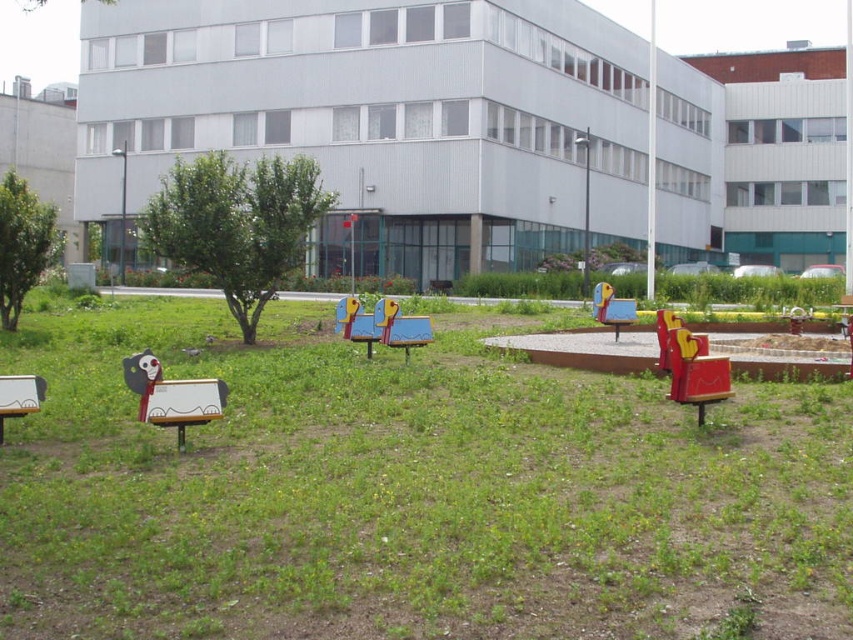
Is point (158, 381) closer to camera compared to point (381, 308)?

Yes.

Does wooden painted bench at lower left have a lesser width compared to wooden painted bench at center?

Yes, wooden painted bench at lower left is thinner than wooden painted bench at center.

Is point (192, 420) positioned behind point (339, 305)?

No, it is in front of (339, 305).

Identify the location of wooden painted bench at lower left. This screenshot has width=853, height=640. (172, 396).

Based on the photo, who is lower down, wooden painted bench at lower left or matte white bench at lower left?

matte white bench at lower left is lower down.

Is wooden painted bench at lower left positioned in front of matte white bench at lower left?

Yes, it is.

Locate an element on the screen. wooden painted bench at lower left is located at coordinates (172, 396).

Is point (546, 586) positioned in front of point (718, 394)?

Yes, it is.

Does wooden bench at lower left appear under wooden painted bench at center right?

Yes.

Who is more distant from viewer, [170,516] or [712,362]?

The point [712,362] is behind.

Identify the location of wooden bench at lower left. The width and height of the screenshot is (853, 640). (408, 492).